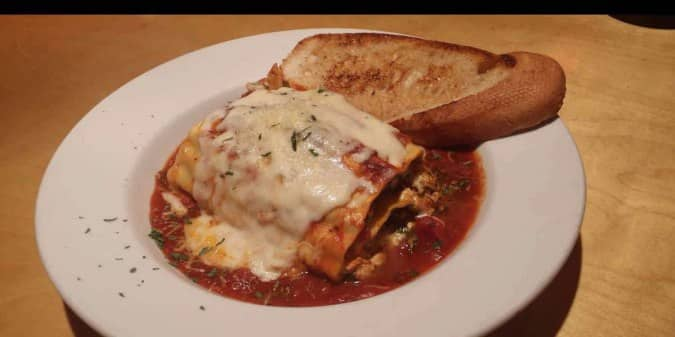
What are the coordinates of `empty space above table` in the screenshot? It's located at (422, 5).